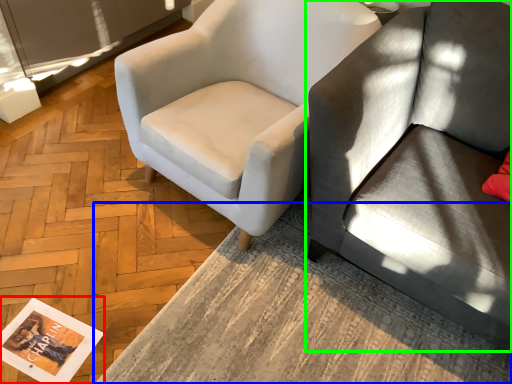
Question: Considering the real-world distances, which object is farthest from magazine (highlighted by a red box)? table (highlighted by a blue box) or studio couch (highlighted by a green box)?

Choices:
 (A) table
 (B) studio couch

Answer: (B)